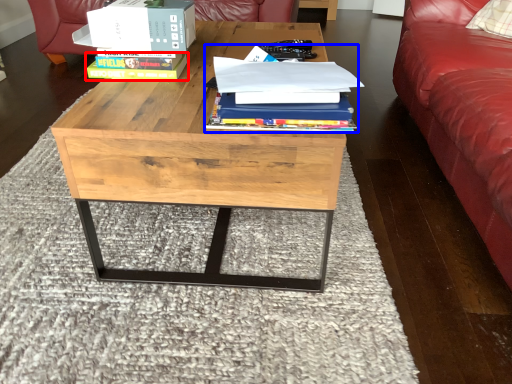
Question: Among these objects, which one is farthest to the camera, paperback book (highlighted by a red box) or book (highlighted by a blue box)?

Choices:
 (A) paperback book
 (B) book

Answer: (A)